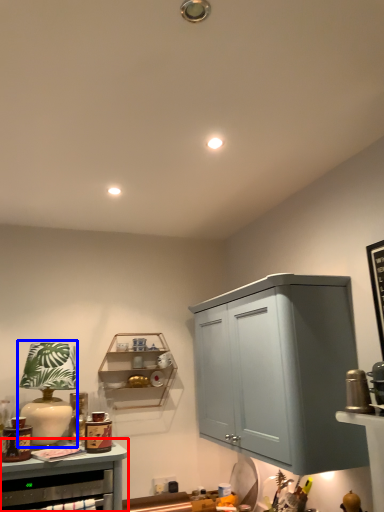
Question: Which object is further to the camera taking this photo, cabinetry (highlighted by a red box) or table lamp (highlighted by a blue box)?

Choices:
 (A) cabinetry
 (B) table lamp

Answer: (B)